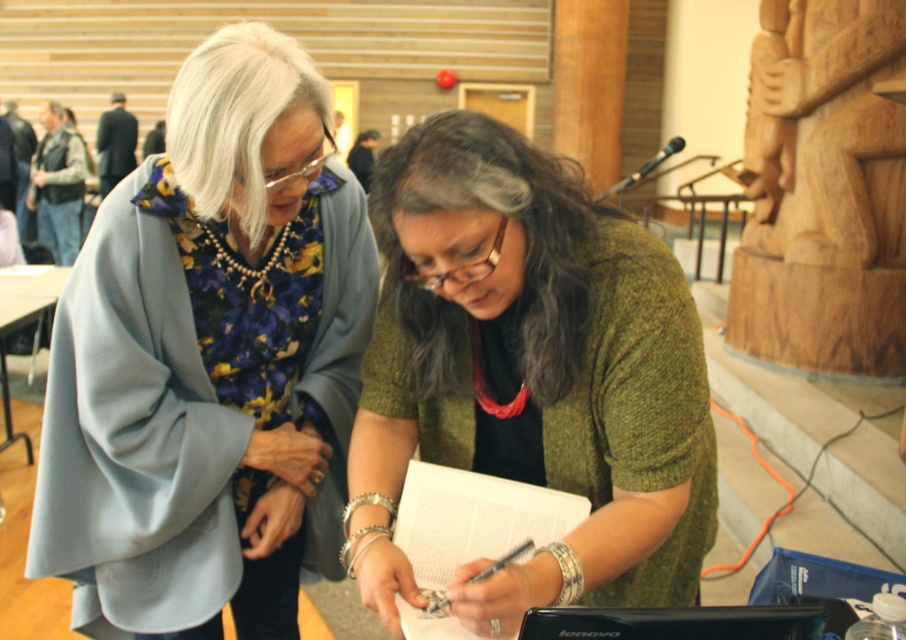
Question: Which of the following is the closest to the observer?

Choices:
 (A) matte blue coat at center
 (B) wooden carving at upper right
 (C) black metallic pen at center

Answer: (C)

Question: Does matte blue coat at center have a lesser width compared to green knitted sweater at center?

Choices:
 (A) yes
 (B) no

Answer: (A)

Question: Which point is farther to the camera?

Choices:
 (A) wooden carving at upper right
 (B) black metallic pen at center
 (C) matte blue coat at center
 (D) green knitted sweater at center

Answer: (A)

Question: Which object is the closest to the matte blue coat at center?

Choices:
 (A) wooden carving at upper right
 (B) black metallic pen at center
 (C) green knitted sweater at center

Answer: (C)

Question: Considering the relative positions of matte blue coat at center and green knitted sweater at center in the image provided, where is matte blue coat at center located with respect to green knitted sweater at center?

Choices:
 (A) right
 (B) left

Answer: (B)

Question: Does green knitted sweater at center lie in front of black metallic pen at center?

Choices:
 (A) no
 (B) yes

Answer: (B)